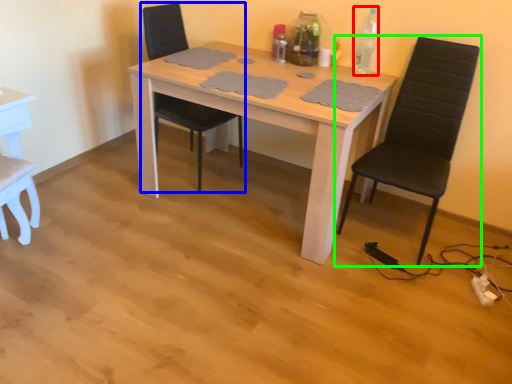
Question: Which object is positioned closest to bottle (highlighted by a red box)? Select from chair (highlighted by a blue box) and chair (highlighted by a green box).

Choices:
 (A) chair
 (B) chair

Answer: (B)